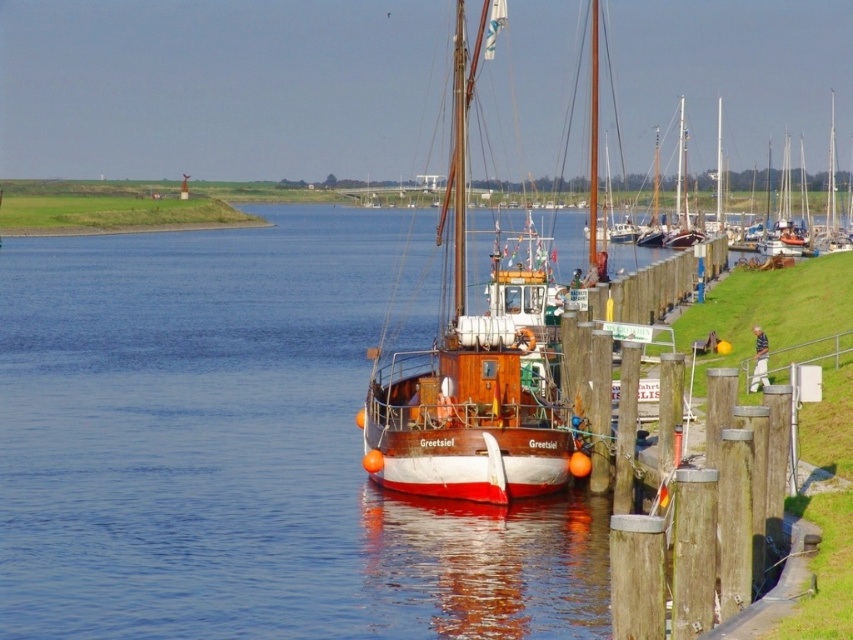
You are standing on the wooden dock and want to walk towards the wooden sailboat at center. Which direction should you walk to avoid stepping into the smooth blue water at center?

To reach the wooden sailboat at center without stepping into the smooth blue water at center, you should walk to the right, as the water is located to the left of the boat.